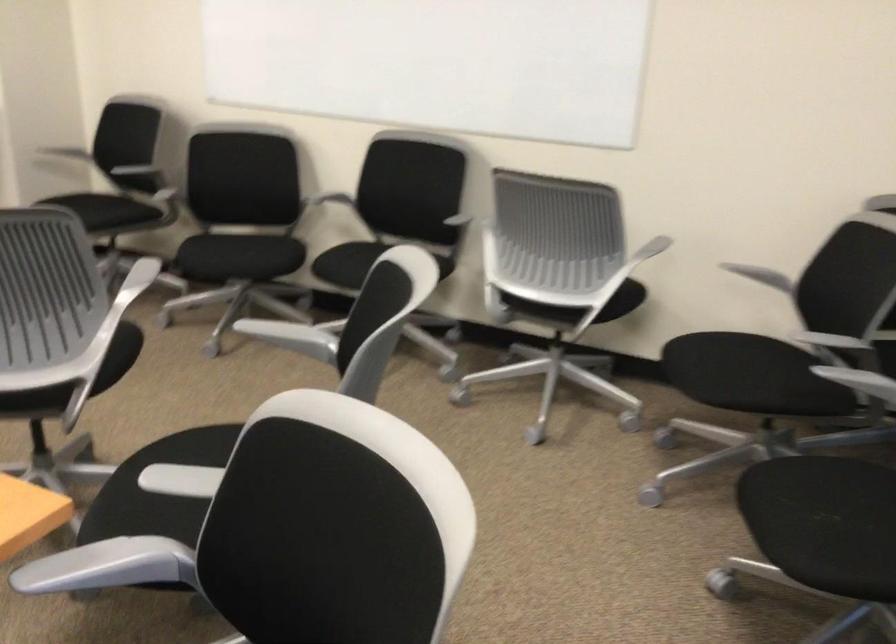
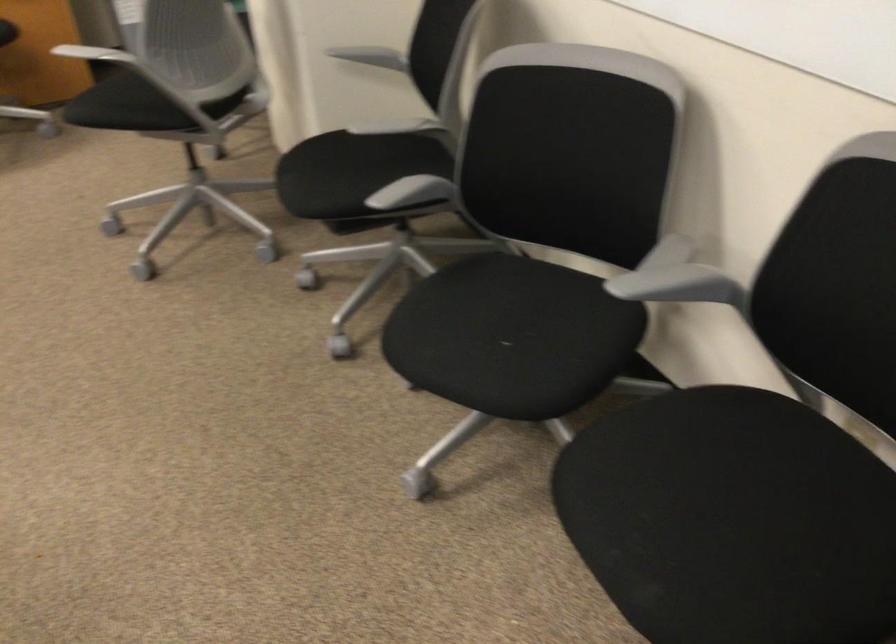
In the second image, find the point that corresponds to [177,192] in the first image.

(412, 193)